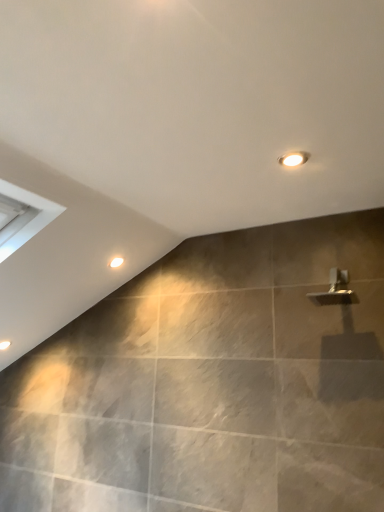
Question: Considering the positions of white glossy droplight at upper center and matte white light fixture at upper center in the image, is white glossy droplight at upper center bigger or smaller than matte white light fixture at upper center?

Choices:
 (A) big
 (B) small

Answer: (A)

Question: Considering the relative positions of white glossy droplight at upper center and matte white light fixture at upper center in the image provided, is white glossy droplight at upper center to the left or to the right of matte white light fixture at upper center?

Choices:
 (A) right
 (B) left

Answer: (B)

Question: In the image, is white glossy droplight at upper center positioned in front of or behind matte white light fixture at upper center?

Choices:
 (A) behind
 (B) front

Answer: (A)

Question: Is matte white light fixture at upper center spatially inside white glossy droplight at upper center, or outside of it?

Choices:
 (A) inside
 (B) outside

Answer: (B)

Question: From the image's perspective, is matte white light fixture at upper center above or below white glossy droplight at upper center?

Choices:
 (A) below
 (B) above

Answer: (B)

Question: Considering the positions of matte white light fixture at upper center and white glossy droplight at upper center in the image, is matte white light fixture at upper center taller or shorter than white glossy droplight at upper center?

Choices:
 (A) tall
 (B) short

Answer: (B)

Question: In the image, is matte white light fixture at upper center on the left side or the right side of white glossy droplight at upper center?

Choices:
 (A) right
 (B) left

Answer: (A)